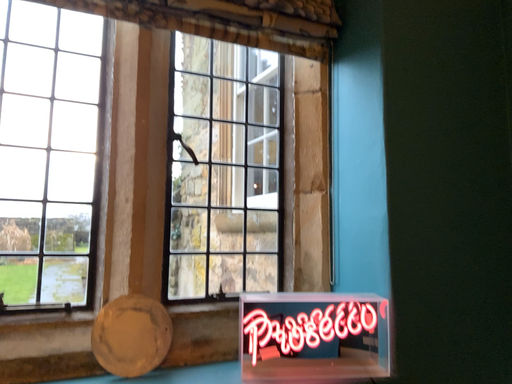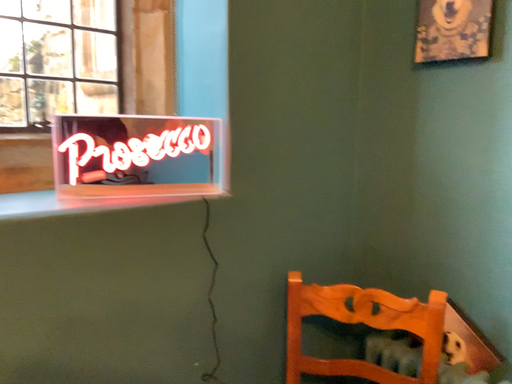
Question: How did the camera likely rotate when shooting the video?

Choices:
 (A) rotated downward
 (B) rotated upward

Answer: (A)